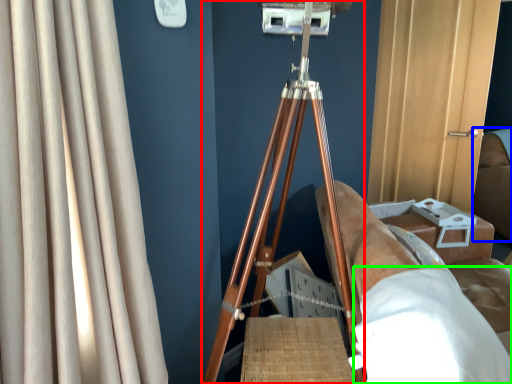
Question: Which object is the farthest from tripod (highlighted by a red box)? Choose among these: couch (highlighted by a blue box) or sheet (highlighted by a green box).

Choices:
 (A) couch
 (B) sheet

Answer: (A)